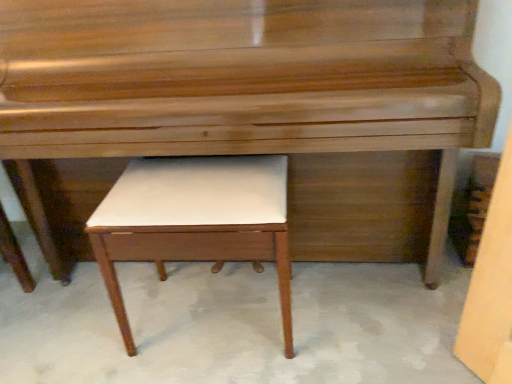
Find the location of a particular element. vacant area that is situated to the right of white leather stool at center is located at coordinates click(x=343, y=315).